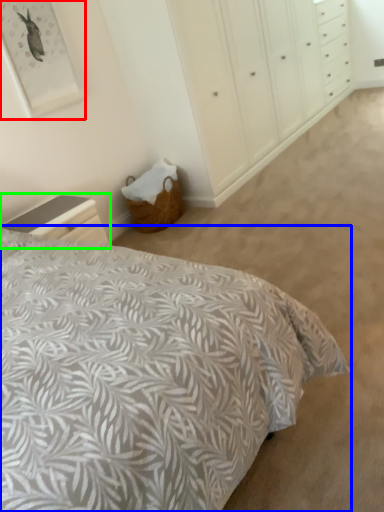
Question: Estimate the real-world distances between objects in this image. Which object is farther from picture frame (highlighted by a red box), bed (highlighted by a blue box) or nightstand (highlighted by a green box)?

Choices:
 (A) bed
 (B) nightstand

Answer: (A)